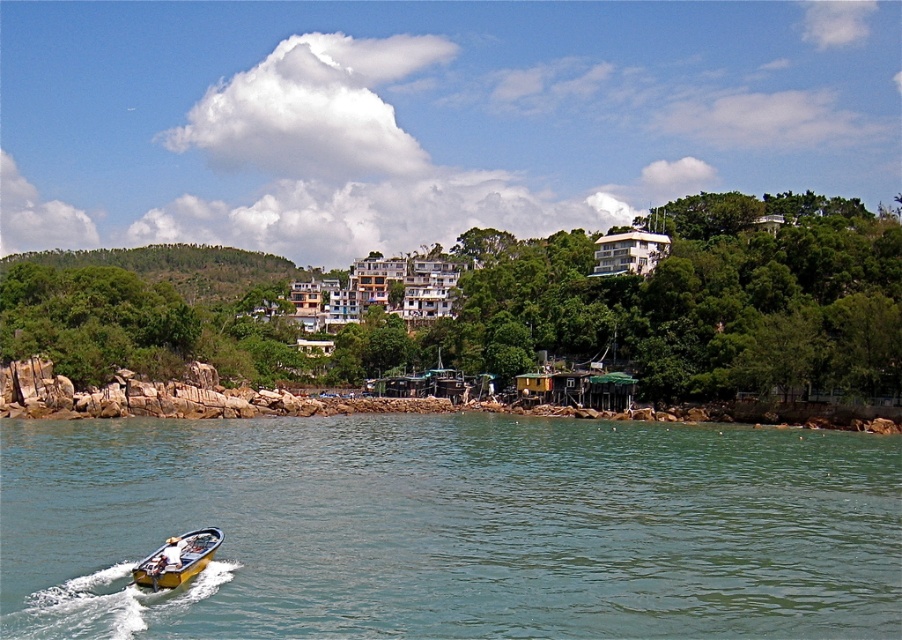
Question: Is clear blue water at lower left positioned before green leafy tree at lower left?

Choices:
 (A) no
 (B) yes

Answer: (B)

Question: Which of the following is the closest to the observer?

Choices:
 (A) (622, 362)
 (B) (154, 579)

Answer: (B)

Question: Considering the relative positions of green leafy tree at lower left and yellow fiberglass boat at lower left in the image provided, where is green leafy tree at lower left located with respect to yellow fiberglass boat at lower left?

Choices:
 (A) left
 (B) right

Answer: (A)

Question: Which of these objects is positioned closest to the green leafy tree at lower left?

Choices:
 (A) yellow fiberglass boat at lower left
 (B) clear blue water at lower left

Answer: (B)

Question: Among these objects, which one is nearest to the camera?

Choices:
 (A) yellow fiberglass boat at lower left
 (B) clear blue water at lower left

Answer: (B)

Question: Can you confirm if green leafy tree at lower left is positioned below yellow fiberglass boat at lower left?

Choices:
 (A) yes
 (B) no

Answer: (B)